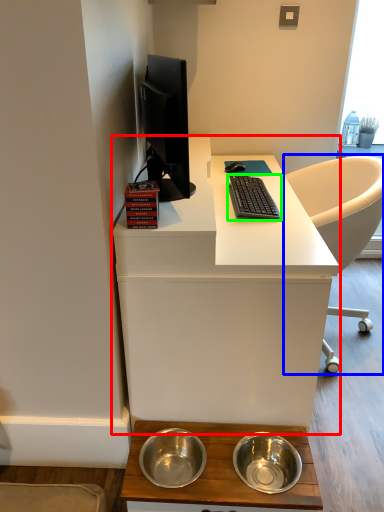
Question: Estimate the real-world distances between objects in this image. Which object is closer to desk (highlighted by a red box), chair (highlighted by a blue box) or computer keyboard (highlighted by a green box)?

Choices:
 (A) chair
 (B) computer keyboard

Answer: (B)